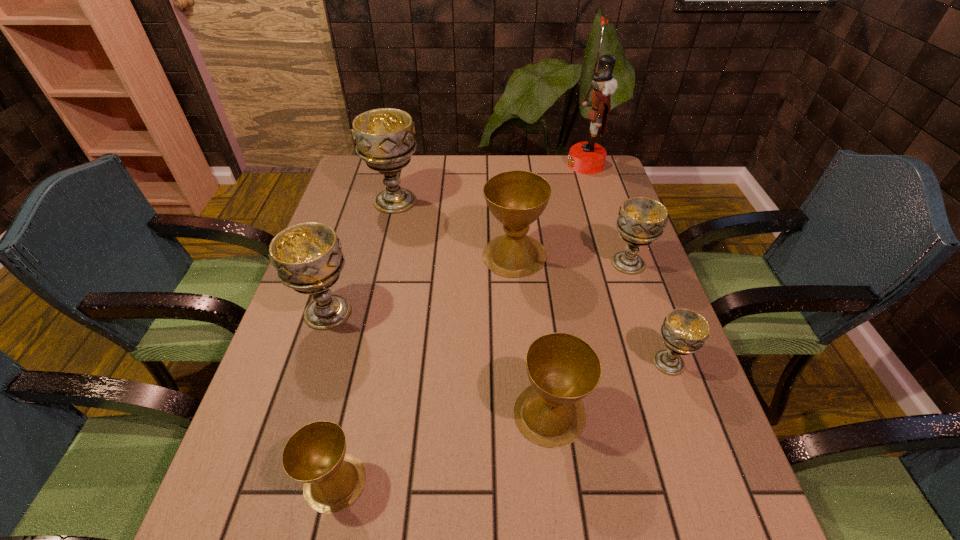
Locate an element on the screen. The image size is (960, 540). the nearest chalice is located at coordinates (315, 454).

Locate an element on the screen. the nearest object is located at coordinates (315, 454).

The image size is (960, 540). Find the location of `the sixth farthest object`. the sixth farthest object is located at coordinates (684, 331).

Identify the location of the third nearest chalice. (684, 331).

Image resolution: width=960 pixels, height=540 pixels. Find the location of `vacant space situated 0.060m on the front-facing side of the red nutcracker`. vacant space situated 0.060m on the front-facing side of the red nutcracker is located at coordinates (551, 165).

Where is `free space located on the front-facing side of the red nutcracker`? The width and height of the screenshot is (960, 540). free space located on the front-facing side of the red nutcracker is located at coordinates (548, 165).

I want to click on free location located 0.070m on the front-facing side of the red nutcracker, so click(548, 165).

I want to click on vacant point located 0.260m on the front of the tallest chalice, so click(x=377, y=278).

Where is `free space located 0.270m on the left of the farthest brown chalice`? Image resolution: width=960 pixels, height=540 pixels. free space located 0.270m on the left of the farthest brown chalice is located at coordinates (385, 255).

Where is `vacant region located on the front of the third smallest white chalice`? This screenshot has height=540, width=960. vacant region located on the front of the third smallest white chalice is located at coordinates (303, 389).